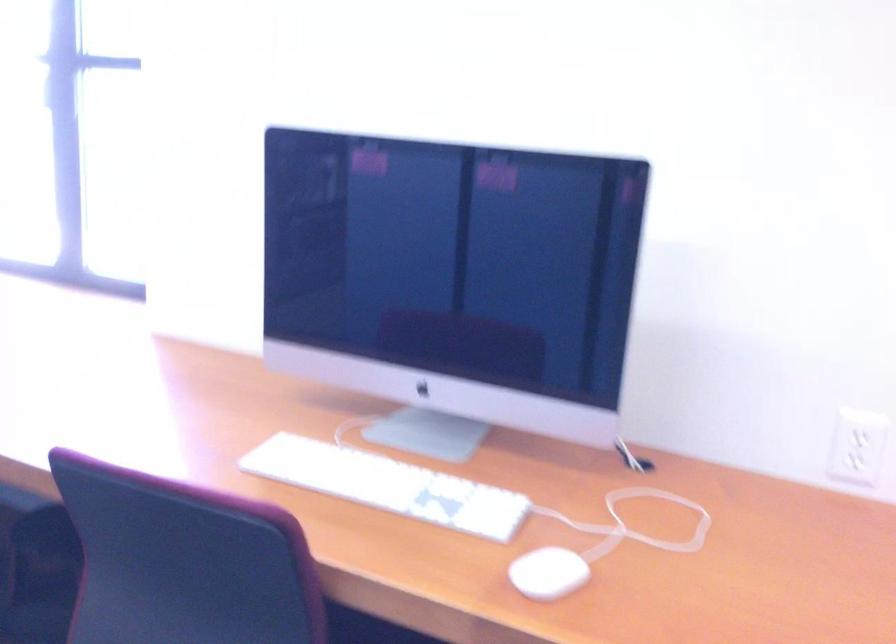
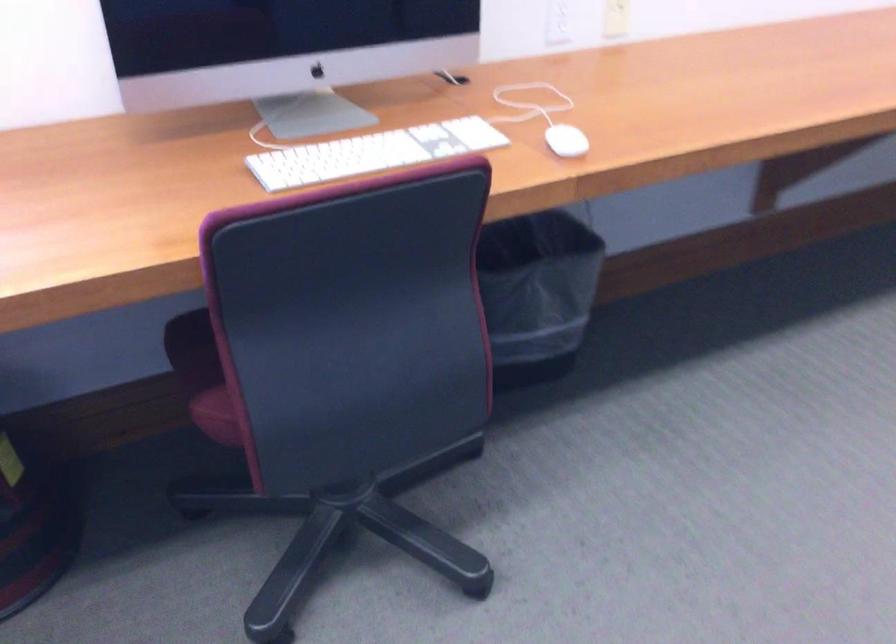
The point at (521, 571) is marked in the first image. Where is the corresponding point in the second image?

(565, 140)